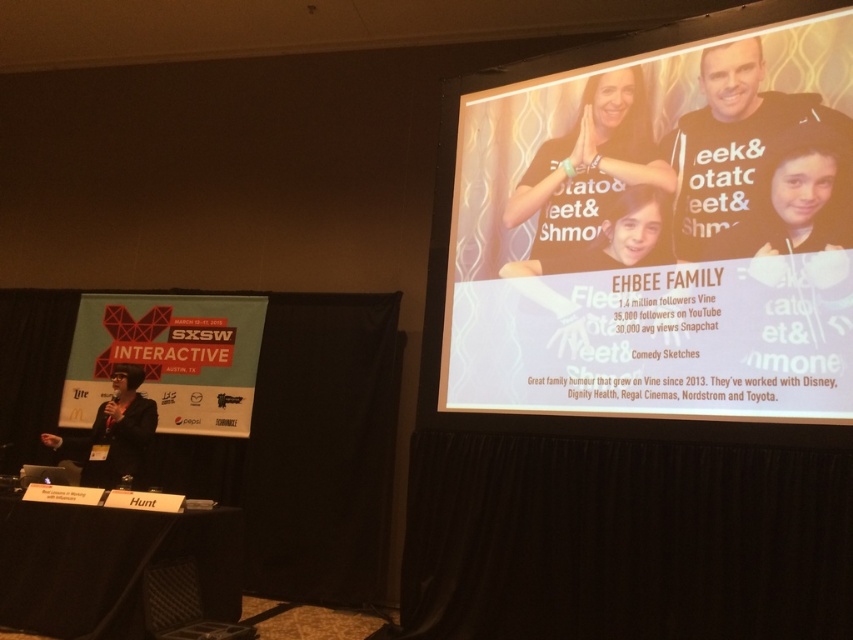
Can you confirm if white t-shirt at upper right is positioned to the right of matte black t-shirt at upper right?

Correct, you'll find white t-shirt at upper right to the right of matte black t-shirt at upper right.

Can you confirm if white t-shirt at upper right is taller than matte black t-shirt at upper right?

Incorrect, white t-shirt at upper right's height is not larger of matte black t-shirt at upper right's.

Is point (726, 182) positioned after point (601, 108)?

No, (726, 182) is in front of (601, 108).

Find the location of a particular element. This screenshot has height=640, width=853. white t-shirt at upper right is located at coordinates (758, 164).

Does white glossy projection screen at upper right appear under matte black t-shirt at upper right?

Yes, white glossy projection screen at upper right is below matte black t-shirt at upper right.

Find the location of a particular element. Image resolution: width=853 pixels, height=640 pixels. white glossy projection screen at upper right is located at coordinates (666, 228).

Based on the photo, which is above, white glossy projection screen at upper right or white t-shirt at upper right?

Positioned higher is white t-shirt at upper right.

Is point (798, 323) less distant than point (732, 241)?

Yes, point (798, 323) is closer to viewer.

The image size is (853, 640). Describe the element at coordinates (666, 228) in the screenshot. I see `white glossy projection screen at upper right` at that location.

The height and width of the screenshot is (640, 853). I want to click on white glossy projection screen at upper right, so click(x=666, y=228).